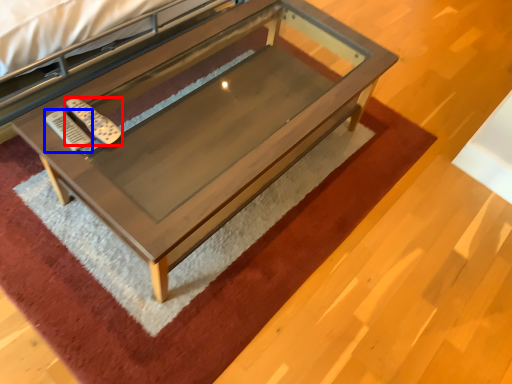
Question: Which of the following is the farthest to the observer, remote (highlighted by a red box) or remote (highlighted by a blue box)?

Choices:
 (A) remote
 (B) remote

Answer: (A)